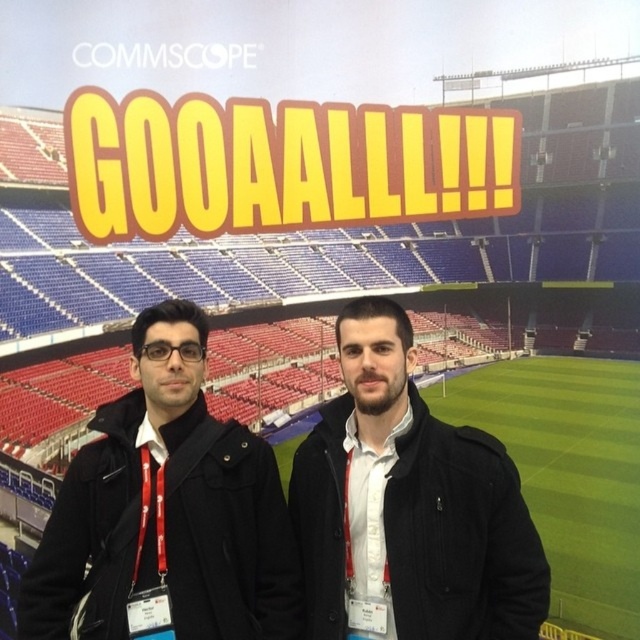
You are a photographer at the event and want to place a red ribbon exactly at the center of the image. The black matte jacket at center is located at point 0.797, 0.261. Is the jacket positioned to the left or right of the image center?

The black matte jacket at center is located at point (166, 509). Since the x coordinate is 0.797, which is greater than 0.5, the jacket is positioned to the right of the image center.

You are a photographer positioned at the camera. You want to capture a closeup shot of the black matte jacket at center. Given that your camera can focus on subjects within 20 meters, will you be able to achieve a clear closeup?

The distance between the black matte jacket at center and the camera is 24.08 meters, which is beyond the camera focus range of 20 meters. Therefore, you cannot achieve a clear closeup.

You are a photographer taking a picture of the backdrop with the two jackets. Which jacket, the black matte jacket at center or the matte black jacket at center, is positioned lower in the image?

The black matte jacket at center is positioned lower than the matte black jacket at center.